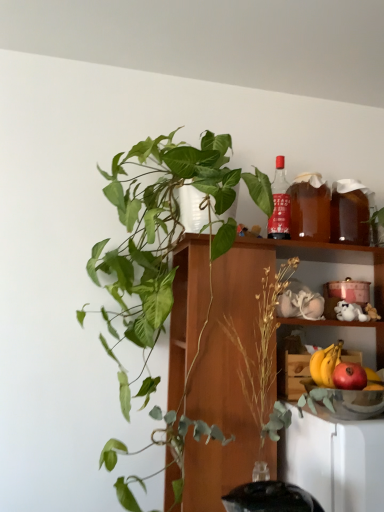
Question: Is point (345, 221) closer or farther from the camera than point (284, 212)?

Choices:
 (A) farther
 (B) closer

Answer: (A)

Question: Relative to red glass bottle at upper right, is translucent amber liquid at shelf right, arranged as the 2th beverage when viewed from the left, in front or behind?

Choices:
 (A) front
 (B) behind

Answer: (B)

Question: Based on their relative distances, which object is farther from the wooden shelf at upper center?

Choices:
 (A) red glass bottle at upper right
 (B) green matte plant at upper left
 (C) red matte apple at lower right
 (D) translucent amber liquid at shelf right, arranged as the 2th beverage when viewed from the left
 (E) brown translucent beverage at upper right, the first beverage from the left

Answer: (C)

Question: Estimate the real-world distances between objects in this image. Which object is closer to the wooden shelf at upper center?

Choices:
 (A) red matte apple at lower right
 (B) brown translucent beverage at upper right, the first beverage from the left
 (C) transparent glass bowl at lower right
 (D) translucent amber liquid at shelf right, arranged as the 2th beverage when viewed from the left
 (E) yellow matte banana at lower right

Answer: (B)